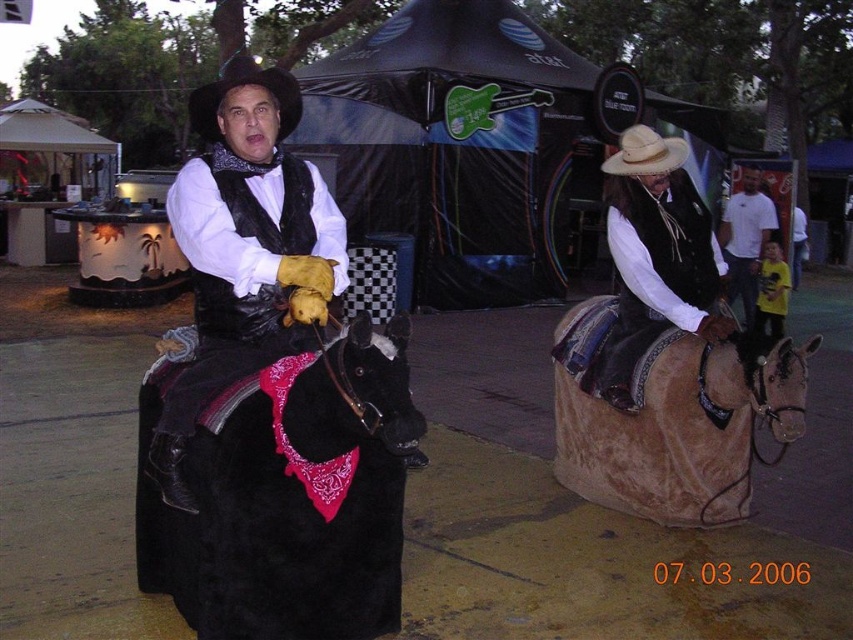
Question: Which of the following is the closest to the observer?

Choices:
 (A) natural straw cowboy hat at upper right
 (B) black felt cowboy hat at upper center

Answer: (B)

Question: Does black leather vest at center have a smaller size compared to black felt cowboy hat at upper center?

Choices:
 (A) yes
 (B) no

Answer: (A)

Question: From the image, what is the correct spatial relationship of black leather vest at center in relation to white cotton shirt at upper right?

Choices:
 (A) right
 (B) left

Answer: (B)

Question: Which point is closer to the camera?

Choices:
 (A) click(277, 83)
 (B) click(270, 326)

Answer: (B)

Question: From the image, what is the correct spatial relationship of black leather vest at center in relation to leather vest at center?

Choices:
 (A) above
 (B) below

Answer: (B)

Question: Which point is farther from the camera taking this photo?

Choices:
 (A) (268, 406)
 (B) (219, 134)
 (C) (641, 440)

Answer: (C)